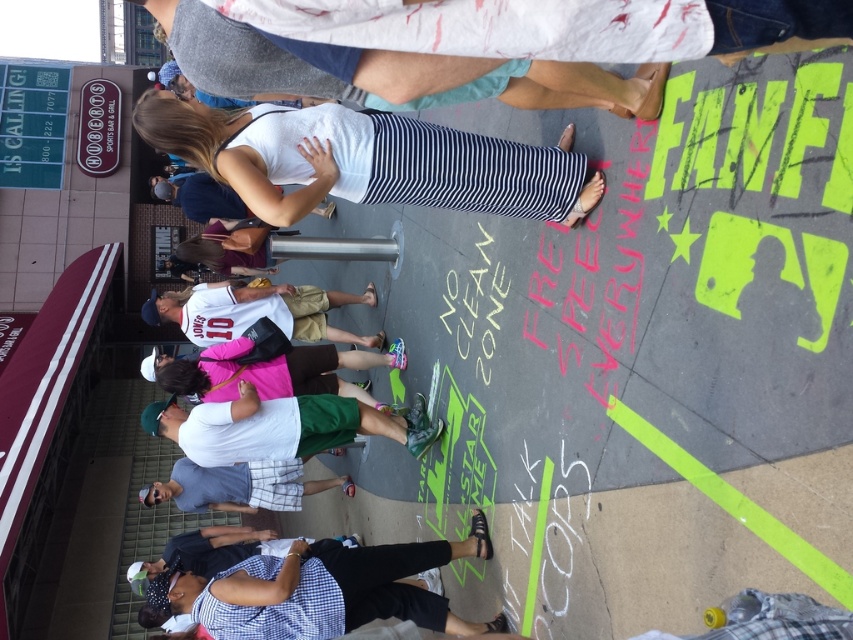
Question: Is white matte shirt at center further to camera compared to pink fabric shirt at center?

Choices:
 (A) no
 (B) yes

Answer: (A)

Question: Observing the image, what is the correct spatial positioning of checkered fabric shirt at lower center in reference to white jersey at center?

Choices:
 (A) below
 (B) above

Answer: (A)

Question: Which of the following is the closest to the observer?

Choices:
 (A) white jersey at center
 (B) white matte shirt at center
 (C) gray plaid shorts at center
 (D) white matte tank top at center

Answer: (D)

Question: Which point appears closest to the camera in this image?

Choices:
 (A) (248, 438)
 (B) (142, 124)
 (C) (193, 317)

Answer: (B)

Question: Does white jersey at center have a greater width compared to pink fabric shirt at center?

Choices:
 (A) no
 (B) yes

Answer: (B)

Question: Which object is positioned closest to the white matte tank top at center?

Choices:
 (A) white matte shirt at center
 (B) white jersey at center

Answer: (A)